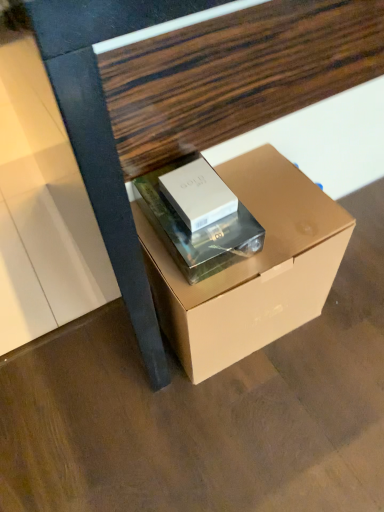
Question: From a real-world perspective, relative to silver metallic box at center, acting as the first box starting from the left, is matte white book at center vertically above or below?

Choices:
 (A) below
 (B) above

Answer: (A)

Question: In terms of width, does matte white book at center look wider or thinner when compared to silver metallic box at center, which is the second box from right to left?

Choices:
 (A) wide
 (B) thin

Answer: (A)

Question: Based on their relative distances, which object is nearer to the matte cardboard box at center, arranged as the first box when viewed from the right?

Choices:
 (A) silver metallic box at center, which is the second box from right to left
 (B) matte white book at center
 (C) matte cardboard box at center

Answer: (B)

Question: Estimate the real-world distances between objects in this image. Which object is farther from the silver metallic box at center, which is the second box from right to left?

Choices:
 (A) matte cardboard box at center
 (B) matte cardboard box at center, arranged as the first box when viewed from the right
 (C) matte white book at center

Answer: (A)